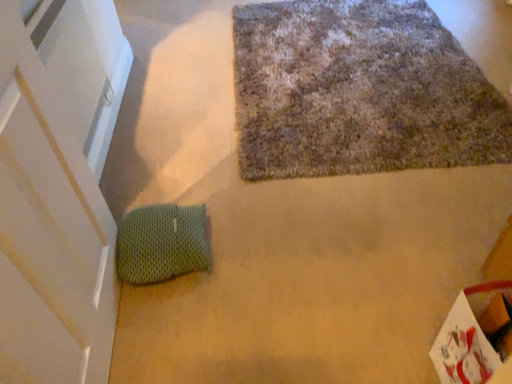
Question: Is green knitted bean bag at lower left in front of or behind textured woolen mat at upper center in the image?

Choices:
 (A) front
 (B) behind

Answer: (A)

Question: Is green knitted bean bag at lower left wider or thinner than textured woolen mat at upper center?

Choices:
 (A) thin
 (B) wide

Answer: (A)

Question: Considering the positions of green knitted bean bag at lower left and textured woolen mat at upper center in the image, is green knitted bean bag at lower left taller or shorter than textured woolen mat at upper center?

Choices:
 (A) tall
 (B) short

Answer: (A)

Question: Is textured woolen mat at upper center in front of or behind green knitted bean bag at lower left in the image?

Choices:
 (A) front
 (B) behind

Answer: (B)

Question: In terms of size, does textured woolen mat at upper center appear bigger or smaller than green knitted bean bag at lower left?

Choices:
 (A) small
 (B) big

Answer: (B)

Question: Do you think textured woolen mat at upper center is within green knitted bean bag at lower left, or outside of it?

Choices:
 (A) outside
 (B) inside

Answer: (A)

Question: Is textured woolen mat at upper center taller or shorter than green knitted bean bag at lower left?

Choices:
 (A) short
 (B) tall

Answer: (A)